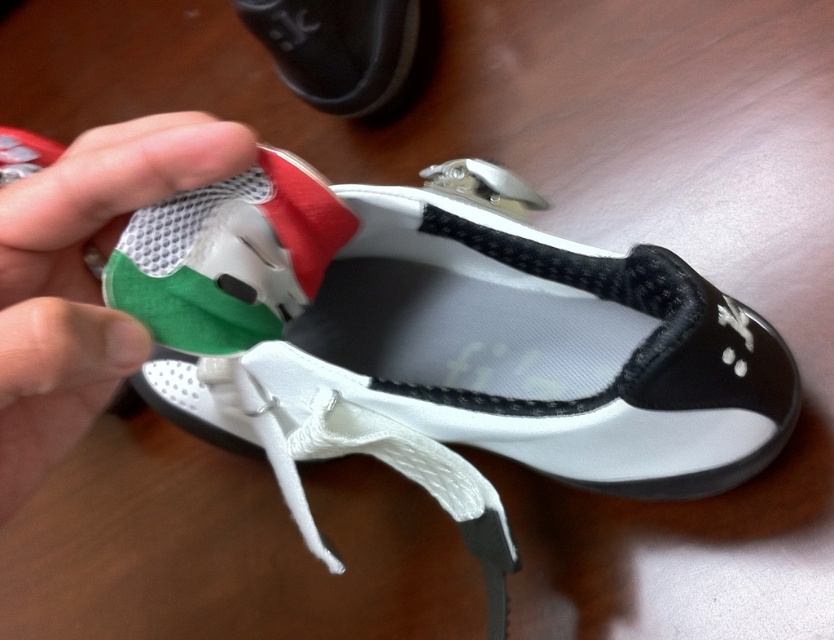
Describe the element at coordinates (84, 276) in the screenshot. I see `green mesh fabric at lower left` at that location.

Between green mesh fabric at lower left and matte black shoe at upper center, which one appears on the right side from the viewer's perspective?

matte black shoe at upper center

Describe the element at coordinates (84, 276) in the screenshot. I see `green mesh fabric at lower left` at that location.

Where is `green mesh fabric at lower left`? The image size is (834, 640). green mesh fabric at lower left is located at coordinates (84, 276).

Can you confirm if white mesh shoe at center is positioned to the right of green mesh fabric at lower left?

Yes, white mesh shoe at center is to the right of green mesh fabric at lower left.

Which is behind, point (585, 484) or point (43, 307)?

Positioned behind is point (585, 484).

Is point (679, 397) positioned in front of point (44, 225)?

No, (679, 397) is further to viewer.

This screenshot has width=834, height=640. In order to click on white mesh shoe at center in this screenshot , I will do `click(538, 342)`.

Is white mesh shoe at center shorter than matte black shoe at upper center?

In fact, white mesh shoe at center may be taller than matte black shoe at upper center.

The width and height of the screenshot is (834, 640). Identify the location of white mesh shoe at center. (538, 342).